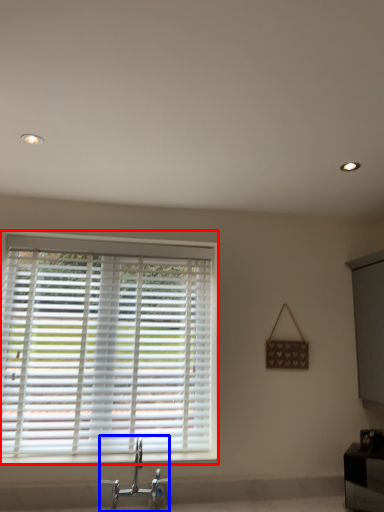
Question: Which of the following is the closest to the observer, window blind (highlighted by a red box) or tap (highlighted by a blue box)?

Choices:
 (A) window blind
 (B) tap

Answer: (B)